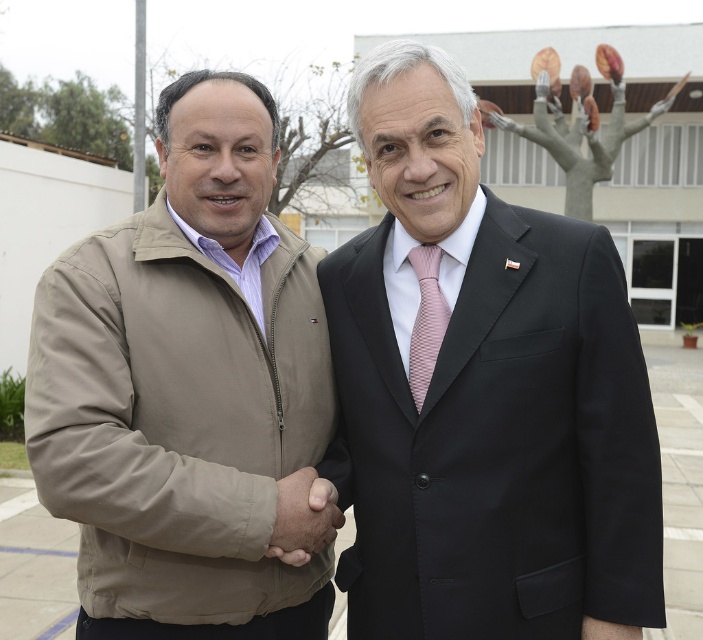
Is black suit at center shorter than pink woven tie at center?

In fact, black suit at center may be taller than pink woven tie at center.

Where is `black suit at center`? The image size is (703, 640). black suit at center is located at coordinates (483, 394).

Identify the location of black suit at center. (483, 394).

Who is more forward, [460,122] or [321,522]?

Point [460,122] is in front.

Identify the location of black suit at center. (483, 394).

Which of these two, tan softshell jacket at left or brown leather hand at center, stands shorter?

brown leather hand at center

Between tan softshell jacket at left and brown leather hand at center, which one has more height?

With more height is tan softshell jacket at left.

Is point (32, 419) closer to viewer compared to point (290, 548)?

Yes, it is in front of point (290, 548).

Where is `tan softshell jacket at left`? The width and height of the screenshot is (703, 640). tan softshell jacket at left is located at coordinates (186, 387).